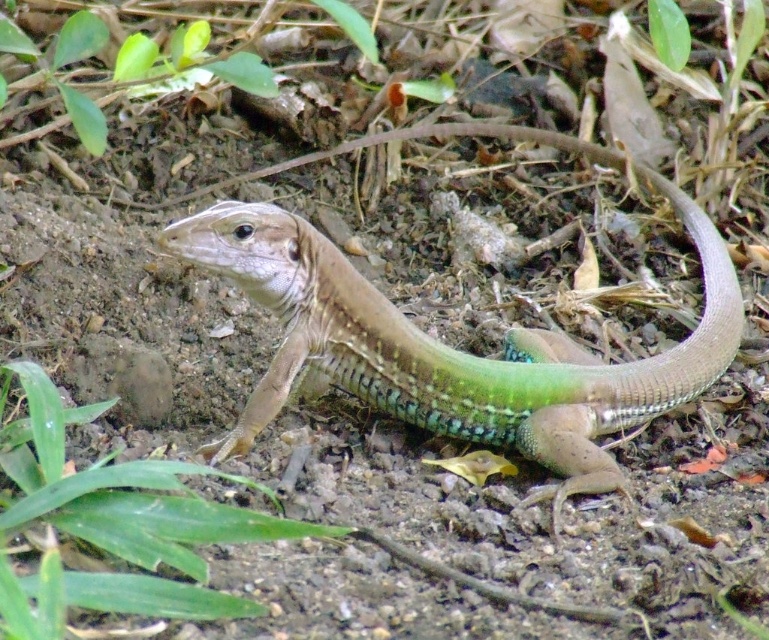
Can you confirm if green scaly lizard at center is positioned to the right of green leafy grass at lower left?

Indeed, green scaly lizard at center is positioned on the right side of green leafy grass at lower left.

Is point (413, 412) behind point (52, 388)?

Yes, point (413, 412) is behind point (52, 388).

Locate an element on the screen. This screenshot has height=640, width=769. green scaly lizard at center is located at coordinates (454, 349).